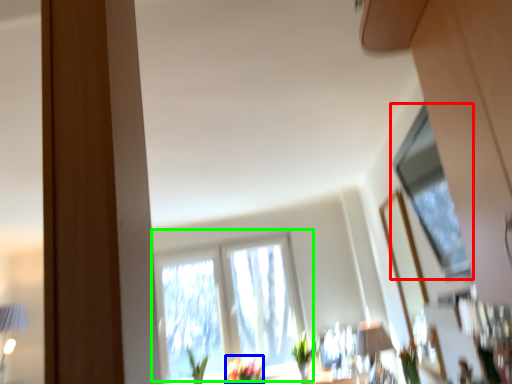
Question: Estimate the real-world distances between objects in this image. Which object is closer to window (highlighted by a red box), flower (highlighted by a blue box) or window (highlighted by a green box)?

Choices:
 (A) flower
 (B) window

Answer: (B)